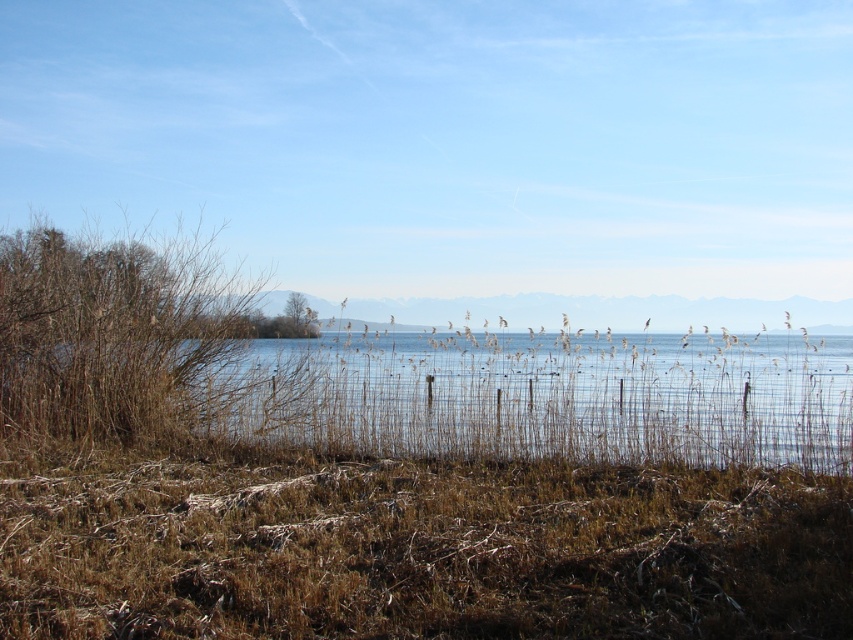
Is clear water at center smaller than brown dry grass at left?

No, clear water at center is not smaller than brown dry grass at left.

Locate an element on the screen. clear water at center is located at coordinates (541, 397).

Locate an element on the screen. clear water at center is located at coordinates (541, 397).

Looking at this image, which is above, brown dry grass at lower center or clear water at center?

clear water at center is higher up.

Describe the element at coordinates (422, 550) in the screenshot. I see `brown dry grass at lower center` at that location.

Where is `brown dry grass at lower center`? This screenshot has height=640, width=853. brown dry grass at lower center is located at coordinates (422, 550).

Is point (128, 561) positioned before point (144, 435)?

Yes, it is.

Who is taller, brown dry grass at lower center or brown dry grass at left?

brown dry grass at lower center

Image resolution: width=853 pixels, height=640 pixels. What are the coordinates of `brown dry grass at lower center` in the screenshot? It's located at (422, 550).

Identify the location of brown dry grass at lower center. (422, 550).